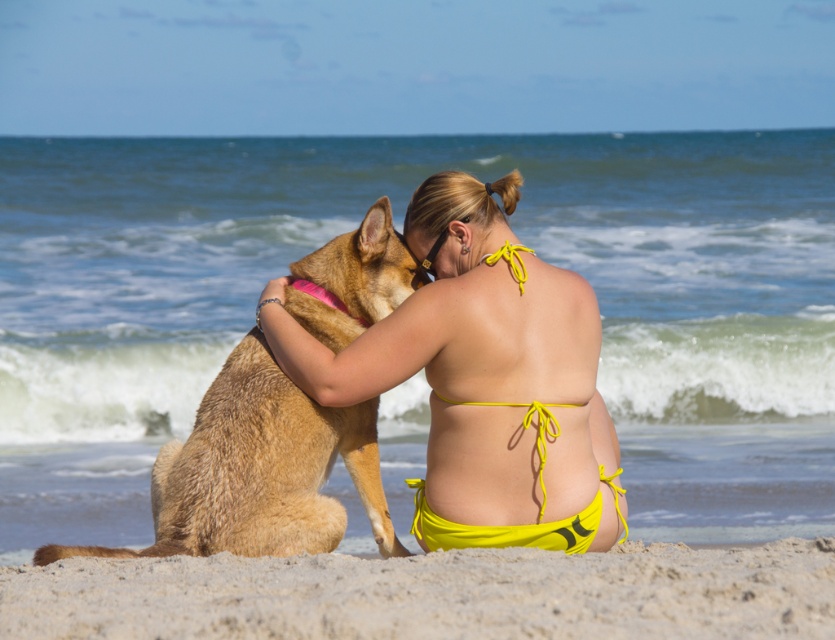
Question: Which point is farther to the camera?

Choices:
 (A) (342, 381)
 (B) (110, 595)
 (C) (196, 525)
 (D) (477, 525)

Answer: (D)

Question: Can you confirm if fine-grained sand at lower center is wider than yellow fabric bikini at center?

Choices:
 (A) no
 (B) yes

Answer: (B)

Question: Does fine-grained sand at lower center have a larger size compared to golden fur dog at center?

Choices:
 (A) yes
 (B) no

Answer: (B)

Question: Can you confirm if yellow bikini at center is positioned to the left of fine-grained sand at lower center?

Choices:
 (A) no
 (B) yes

Answer: (A)

Question: Which point is closer to the camera taking this photo?

Choices:
 (A) (421, 515)
 (B) (266, 449)

Answer: (B)

Question: Which object is the closest to the fine-grained sand at lower center?

Choices:
 (A) yellow fabric bikini at center
 (B) yellow bikini at center

Answer: (B)